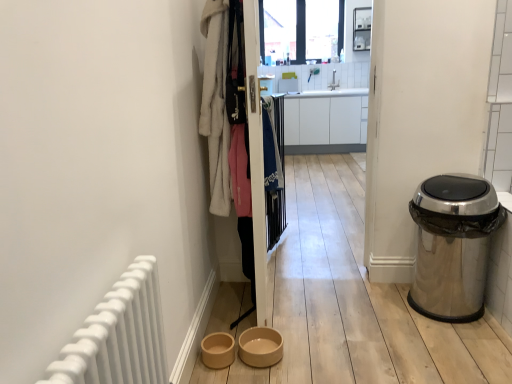
The width and height of the screenshot is (512, 384). What do you see at coordinates (218, 350) in the screenshot?
I see `brown matte bowl at lower center, arranged as the second toilet bowl when viewed from the right` at bounding box center [218, 350].

Measure the distance between point (240,32) and camera.

Point (240,32) is 1.77 meters from camera.

What is the approximate height of white glossy sink at upper center?

white glossy sink at upper center is 12.63 inches tall.

Identify the location of white matte radiator at left. (119, 335).

What do you see at coordinates (326, 118) in the screenshot?
I see `white glossy cabinet at center` at bounding box center [326, 118].

This screenshot has height=384, width=512. I want to click on transparent glass window at upper center, so click(301, 30).

Is white fluffy bathrobe at upper left, which is counted as the second clothing, starting from the back, inside beige ceramic bowl at lower center, which appears as the first toilet bowl when viewed from the right?

No, white fluffy bathrobe at upper left, which is counted as the second clothing, starting from the back, is not a part of beige ceramic bowl at lower center, which appears as the first toilet bowl when viewed from the right.

Is beige ceramic bowl at lower center, which is the second toilet bowl from left to right, far away from white fluffy bathrobe at upper left, which is counted as the second clothing, starting from the back?

beige ceramic bowl at lower center, which is the second toilet bowl from left to right, is actually quite close to white fluffy bathrobe at upper left, which is counted as the second clothing, starting from the back.

How much distance is there between beige ceramic bowl at lower center, which is the second toilet bowl from left to right, and white fluffy bathrobe at upper left, the 2th clothing when ordered from right to left?

→ beige ceramic bowl at lower center, which is the second toilet bowl from left to right, and white fluffy bathrobe at upper left, the 2th clothing when ordered from right to left, are 37.04 inches apart.

Can you confirm if beige ceramic bowl at lower center, which is the second toilet bowl from left to right, is positioned to the left of white fluffy bathrobe at upper left, the first clothing in the front-to-back sequence?

No, beige ceramic bowl at lower center, which is the second toilet bowl from left to right, is not to the left of white fluffy bathrobe at upper left, the first clothing in the front-to-back sequence.

Considering the positions of objects wooden screen door at center and transparent glass window at upper center in the image provided, who is more to the left, wooden screen door at center or transparent glass window at upper center?

From the viewer's perspective, wooden screen door at center appears more on the left side.

Considering the relative sizes of wooden screen door at center and transparent glass window at upper center in the image provided, is wooden screen door at center wider than transparent glass window at upper center?

Yes, wooden screen door at center is wider than transparent glass window at upper center.

Considering the relative sizes of wooden screen door at center and transparent glass window at upper center in the image provided, is wooden screen door at center shorter than transparent glass window at upper center?

No.

Does wooden screen door at center contain transparent glass window at upper center?

Definitely not — transparent glass window at upper center is not inside wooden screen door at center.

Measure the distance from wooden screen door at center to white fluffy bathrobe at upper left, the 2th clothing when ordered from right to left.

wooden screen door at center is 11.82 inches away from white fluffy bathrobe at upper left, the 2th clothing when ordered from right to left.

Looking at their sizes, would you say wooden screen door at center is wider or thinner than white fluffy bathrobe at upper left, the first clothing in the front-to-back sequence?

wooden screen door at center is thinner than white fluffy bathrobe at upper left, the first clothing in the front-to-back sequence.

Between wooden screen door at center and white fluffy bathrobe at upper left, which is counted as the second clothing, starting from the back, which one has larger size?

Bigger between the two is wooden screen door at center.

Is beige ceramic bowl at lower center, which is the second toilet bowl from left to right, smaller than brown matte bowl at lower center, the first toilet bowl in the left-to-right sequence?

Incorrect, beige ceramic bowl at lower center, which is the second toilet bowl from left to right, is not smaller in size than brown matte bowl at lower center, the first toilet bowl in the left-to-right sequence.

Considering the sizes of objects beige ceramic bowl at lower center, which is the second toilet bowl from left to right, and brown matte bowl at lower center, arranged as the second toilet bowl when viewed from the right, in the image provided, who is thinner, beige ceramic bowl at lower center, which is the second toilet bowl from left to right, or brown matte bowl at lower center, arranged as the second toilet bowl when viewed from the right,?

With smaller width is brown matte bowl at lower center, arranged as the second toilet bowl when viewed from the right.

Is beige ceramic bowl at lower center, which appears as the first toilet bowl when viewed from the right, completely or partially outside of brown matte bowl at lower center, the first toilet bowl in the left-to-right sequence?

Indeed, beige ceramic bowl at lower center, which appears as the first toilet bowl when viewed from the right, is completely outside brown matte bowl at lower center, the first toilet bowl in the left-to-right sequence.

How different are the orientations of beige ceramic bowl at lower center, which is the second toilet bowl from left to right, and brown matte bowl at lower center, arranged as the second toilet bowl when viewed from the right, in degrees?

beige ceramic bowl at lower center, which is the second toilet bowl from left to right, and brown matte bowl at lower center, arranged as the second toilet bowl when viewed from the right, are facing 0.00121 degrees away from each other.

From a real-world perspective, is beige ceramic bowl at lower center, which is the second toilet bowl from left to right, below transparent glass window at upper center?

Yes.

Is the surface of beige ceramic bowl at lower center, which appears as the first toilet bowl when viewed from the right, in direct contact with transparent glass window at upper center?

No, beige ceramic bowl at lower center, which appears as the first toilet bowl when viewed from the right, is not touching transparent glass window at upper center.

From the image's perspective, who appears lower, beige ceramic bowl at lower center, which is the second toilet bowl from left to right, or transparent glass window at upper center?

beige ceramic bowl at lower center, which is the second toilet bowl from left to right.

Considering the relative sizes of beige ceramic bowl at lower center, which is the second toilet bowl from left to right, and transparent glass window at upper center in the image provided, is beige ceramic bowl at lower center, which is the second toilet bowl from left to right, taller than transparent glass window at upper center?

No, beige ceramic bowl at lower center, which is the second toilet bowl from left to right, is not taller than transparent glass window at upper center.

How much distance is there between white glossy cabinet at center and clear glass shelves at upper center?

A distance of 38.79 inches exists between white glossy cabinet at center and clear glass shelves at upper center.

Considering the positions of objects white glossy cabinet at center and clear glass shelves at upper center in the image provided, who is more to the left, white glossy cabinet at center or clear glass shelves at upper center?

From the viewer's perspective, white glossy cabinet at center appears more on the left side.

Could you tell me if white glossy cabinet at center is facing clear glass shelves at upper center?

No.

Which object is thinner, white glossy cabinet at center or clear glass shelves at upper center?

clear glass shelves at upper center.

Is the depth of wooden screen door at center greater than that of polished stainless steel trash can at right?

No, it is not.

The image size is (512, 384). I want to click on waste container that appears on the right of wooden screen door at center, so click(453, 245).

Does wooden screen door at center turn towards polished stainless steel trash can at right?

Yes, wooden screen door at center faces towards polished stainless steel trash can at right.

Is wooden screen door at center spatially inside polished stainless steel trash can at right, or outside of it?

The correct answer is: outside.

The width and height of the screenshot is (512, 384). There is a white fluffy bathrobe at upper left, the 2th clothing when ordered from right to left. In order to click on the 1st toilet bowl below it (from the image's perspective) in this screenshot , I will do `click(260, 347)`.

I want to click on window screen on the right of wooden screen door at center, so click(301, 30).

Looking at the image, which one is located further to brown matte bowl at lower center, the first toilet bowl in the left-to-right sequence, blue fabric at center, the first clothing positioned from the right, or wooden screen door at center?

blue fabric at center, the first clothing positioned from the right, is positioned further to the anchor brown matte bowl at lower center, the first toilet bowl in the left-to-right sequence.

From the image, which object appears to be farther from white fluffy bathrobe at upper left, the first clothing in the front-to-back sequence, clear glass shelves at upper center or brown matte bowl at lower center, the first toilet bowl in the left-to-right sequence?

Among the two, clear glass shelves at upper center is located further to white fluffy bathrobe at upper left, the first clothing in the front-to-back sequence.

From the image, which object appears to be nearer to blue fabric at center, which is the 2th clothing from front to back, brown matte bowl at lower center, the first toilet bowl in the left-to-right sequence, or wooden screen door at center?

Based on the image, wooden screen door at center appears to be nearer to blue fabric at center, which is the 2th clothing from front to back.

Estimate the real-world distances between objects in this image. Which object is further from clear glass shelves at upper center, white glossy cabinet at center or white matte radiator at left?

white matte radiator at left lies further to clear glass shelves at upper center than the other object.

Estimate the real-world distances between objects in this image. Which object is further from transparent glass window at upper center, white matte radiator at left or clear glass shelves at upper center?

white matte radiator at left lies further to transparent glass window at upper center than the other object.

Estimate the real-world distances between objects in this image. Which object is further from blue fabric at center, which is the 2th clothing from front to back, white glossy cabinet at center or white matte radiator at left?

white glossy cabinet at center.

Which object lies nearer to the anchor point clear glass shelves at upper center, white matte radiator at left or transparent glass window at upper center?

transparent glass window at upper center is closer to clear glass shelves at upper center.

Looking at the image, which one is located further to white fluffy bathrobe at upper left, which is counted as the second clothing, starting from the back, polished stainless steel trash can at right or wooden screen door at center?

polished stainless steel trash can at right is positioned further to the anchor white fluffy bathrobe at upper left, which is counted as the second clothing, starting from the back.

I want to click on waste container positioned between white fluffy bathrobe at upper left, which is counted as the second clothing, starting from the back, and clear glass shelves at upper center from near to far, so click(453, 245).

I want to click on waste container located between wooden screen door at center and clear glass shelves at upper center in the depth direction, so click(453, 245).

Identify the location of clothing between white fluffy bathrobe at upper left, placed as the 1th clothing when sorted from left to right, and brown matte bowl at lower center, arranged as the second toilet bowl when viewed from the right, in the up-down direction. [273, 144].

The width and height of the screenshot is (512, 384). In order to click on cabinetry between white fluffy bathrobe at upper left, which is counted as the second clothing, starting from the back, and clear glass shelves at upper center, along the z-axis in this screenshot , I will do `click(326, 118)`.